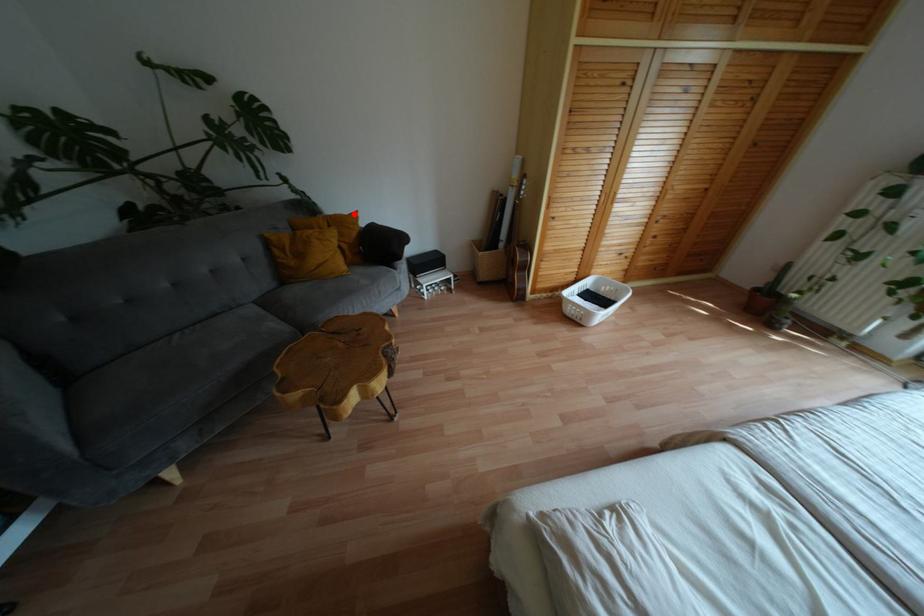
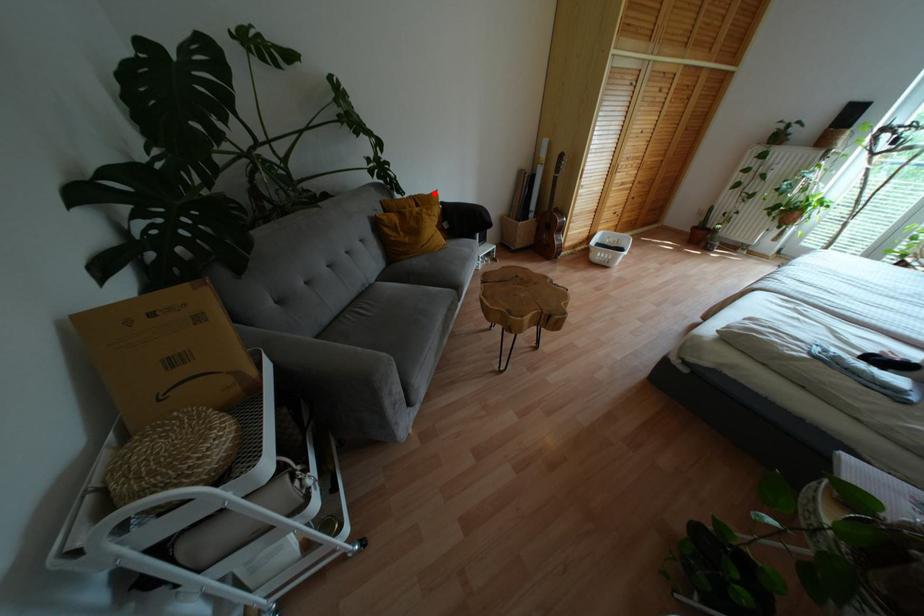
I am providing you with two images of the same scene from different viewpoints. A red point is marked on the first image and another point is marked on the second image. Are the points marked in image1 and image2 representing the same 3D position?

Yes